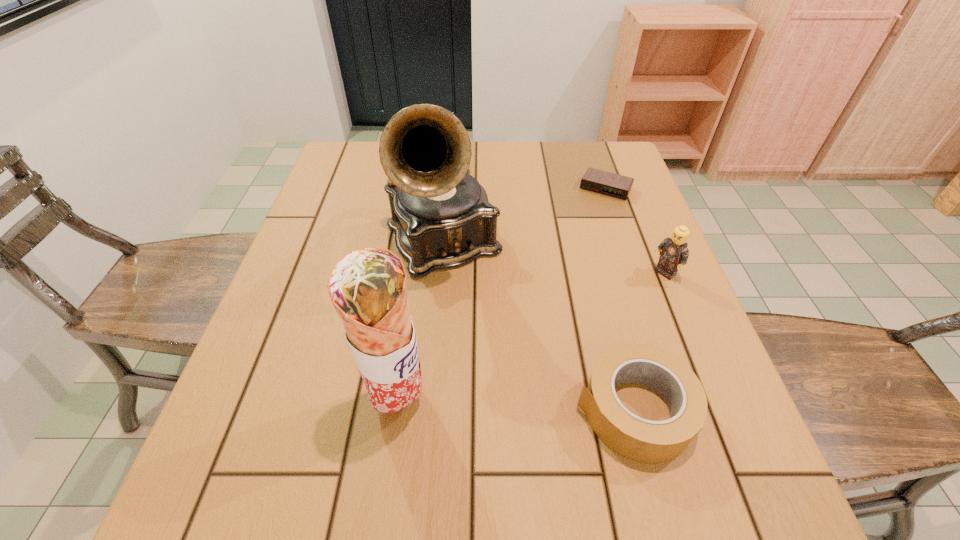
This screenshot has height=540, width=960. Identify the location of the second tallest object. (368, 287).

Where is `the second shortest object`? This screenshot has height=540, width=960. the second shortest object is located at coordinates (638, 439).

Locate an element on the screen. The height and width of the screenshot is (540, 960). the farthest object is located at coordinates (602, 182).

Locate an element on the screen. the shortest object is located at coordinates (602, 182).

Locate an element on the screen. the third tallest object is located at coordinates (674, 253).

Image resolution: width=960 pixels, height=540 pixels. Identify the location of the tallest object. (441, 216).

Where is `free space located 0.050m on the back of the burrito`? free space located 0.050m on the back of the burrito is located at coordinates (406, 354).

Where is `free region located 0.190m at the edge of the second shortest object`? The height and width of the screenshot is (540, 960). free region located 0.190m at the edge of the second shortest object is located at coordinates (469, 410).

The width and height of the screenshot is (960, 540). In order to click on vacant region located at the edge of the second shortest object in this screenshot , I will do `click(526, 410)`.

Find the location of a particular element. This screenshot has height=540, width=960. free location located at the edge of the second shortest object is located at coordinates (441, 410).